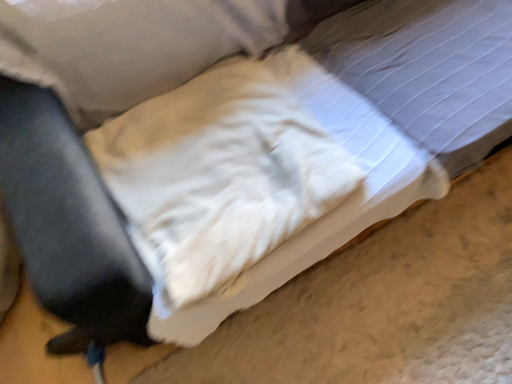
Question: Should I look upward or downward to see white fluffy pillow at center?

Choices:
 (A) up
 (B) down

Answer: (A)